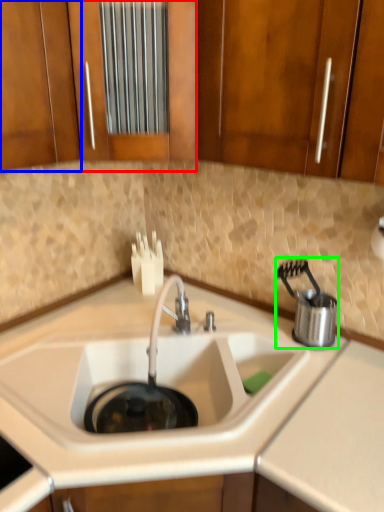
Question: Which object is positioned farthest from cabinetry (highlighted by a red box)? Select from cabinetry (highlighted by a blue box) and appliance (highlighted by a green box).

Choices:
 (A) cabinetry
 (B) appliance

Answer: (B)